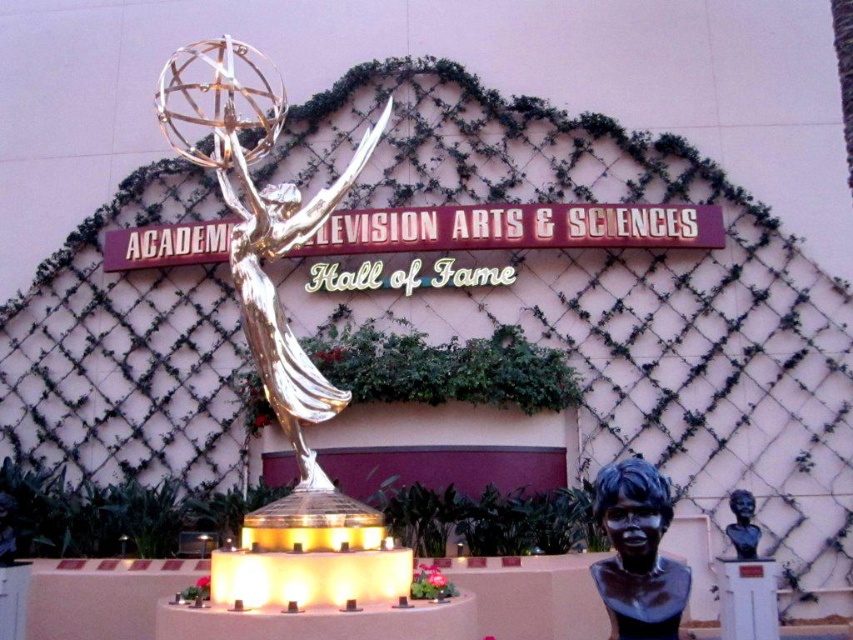
Does shiny silver bust at lower right have a greater height compared to black polished bust at lower right?

Yes.

Measure the distance from shiny silver bust at lower right to black polished bust at lower right.

shiny silver bust at lower right is 11.85 meters from black polished bust at lower right.

Locate an element on the screen. The image size is (853, 640). shiny silver bust at lower right is located at coordinates (637, 552).

At what (x,y) coordinates should I click in order to perform the action: click on shiny silver bust at lower right. Please return your answer as a coordinate pair (x, y). Looking at the image, I should click on (637, 552).

Can you confirm if gold metallic emmy statue at center is taller than black polished bust at lower right?

Yes.

Does point (224, 90) come closer to viewer compared to point (727, 536)?

Yes, it is in front of point (727, 536).

You are a GUI agent. You are given a task and a screenshot of the screen. Output one action in this format:
    pyautogui.click(x=<x>, y=<y>)
    Task: Click on the gold metallic emmy statue at center
    
    Given the screenshot: What is the action you would take?
    pyautogui.click(x=258, y=214)

Is point (248, 45) farther from viewer compared to point (627, 481)?

Yes, it is.

Measure the distance between point (260, 252) and camera.

The distance of point (260, 252) from camera is 40.43 meters.

Does point (277, 188) lie behind point (619, 477)?

Yes, point (277, 188) is farther from viewer.

Identify the location of gold metallic emmy statue at center. (258, 214).